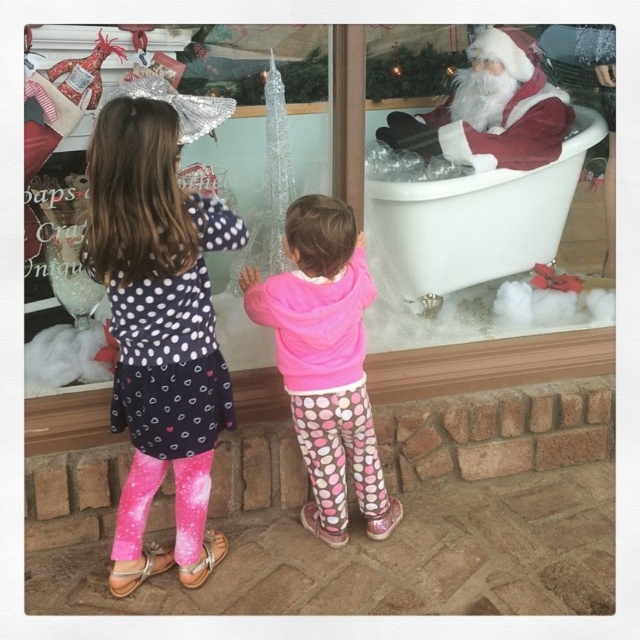
Question: Does pink glitter leggings at left appear under velvet santa claus at right?

Choices:
 (A) no
 (B) yes

Answer: (B)

Question: Which of the following is the farthest from the observer?

Choices:
 (A) (310, 323)
 (B) (467, 230)
 (C) (125, 278)
 (D) (406, 124)

Answer: (D)

Question: Which of the following is the closest to the observer?

Choices:
 (A) click(518, 136)
 (B) click(330, 326)
 (C) click(157, 216)
 (D) click(380, 193)

Answer: (C)

Question: Among these objects, which one is farthest from the camera?

Choices:
 (A) velvet santa claus at right
 (B) white porcelain bathtub at right
 (C) pink glitter leggings at left
 (D) pink polka dot pants at center

Answer: (A)

Question: Observing the image, what is the correct spatial positioning of pink polka dot pants at center in reference to velvet santa claus at right?

Choices:
 (A) below
 (B) above

Answer: (A)

Question: Is white porcelain bathtub at right positioned behind velvet santa claus at right?

Choices:
 (A) yes
 (B) no

Answer: (B)